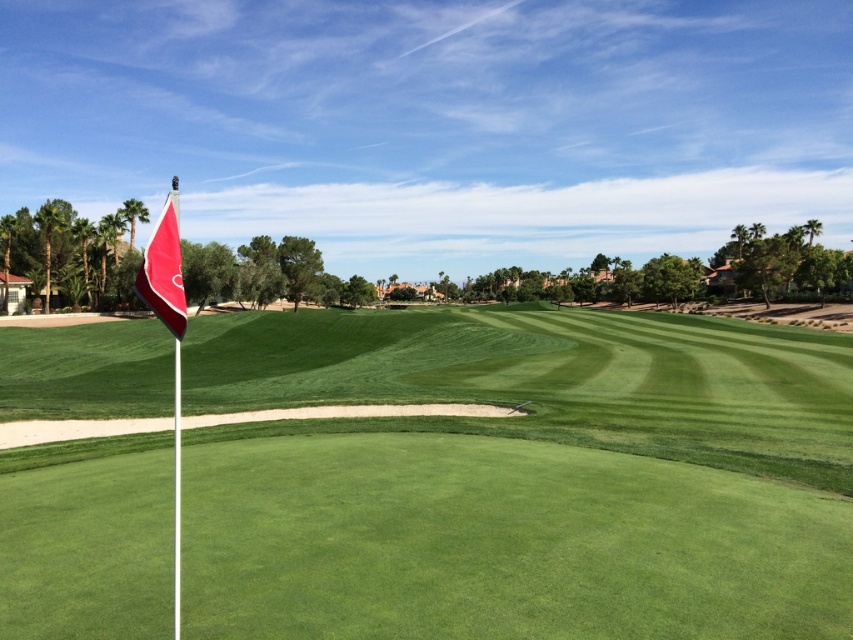
Question: Which object is closer to the camera taking this photo?

Choices:
 (A) green grass at center
 (B) red matte flag at left

Answer: (B)

Question: Can you confirm if green grass at center is wider than red matte flag at left?

Choices:
 (A) no
 (B) yes

Answer: (B)

Question: Which point is closer to the camera?

Choices:
 (A) (238, 337)
 (B) (161, 218)

Answer: (B)

Question: Which point is farther to the camera?

Choices:
 (A) red matte flag at left
 (B) green grass at center

Answer: (B)

Question: Is green grass at center to the right of red matte flag at left from the viewer's perspective?

Choices:
 (A) no
 (B) yes

Answer: (B)

Question: From the image, what is the correct spatial relationship of green grass at center in relation to red matte flag at left?

Choices:
 (A) right
 (B) left

Answer: (A)